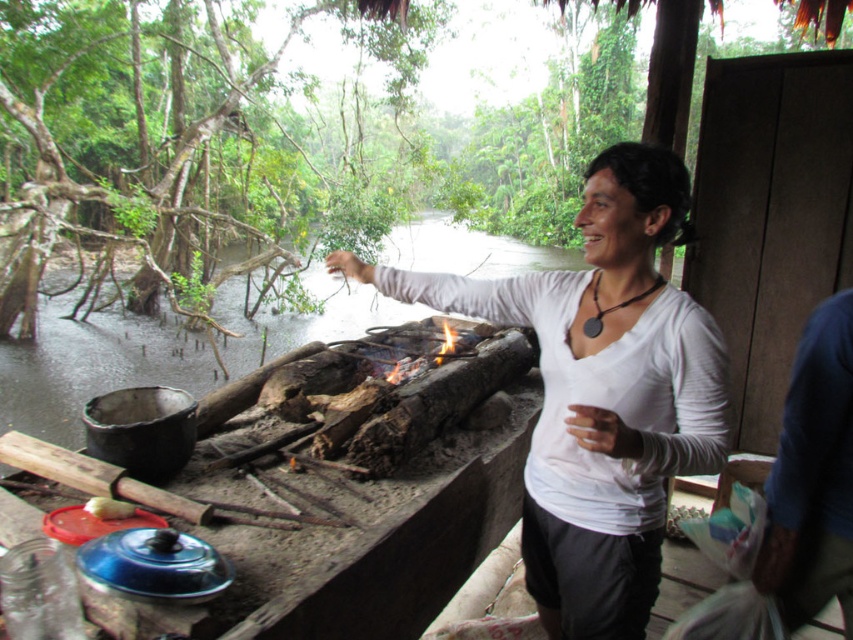
You are an observer standing in front of the cooking area. You notice two shirts hanging near the fire. The white matte shirt at center and the blue fabric shirt at right. Which shirt is positioned higher relative to the other?

The white matte shirt at center is positioned higher than the blue fabric shirt at right.

You are standing in the rustic outdoor cooking area near the river. You need to reach both the point at coordinates point (x=544, y=330) and the point at coordinates point (x=827, y=442). Which point will you reach first as you move forward?

You will reach the point at coordinates point (x=544, y=330) first because it is closer to you than the point at coordinates point (x=827, y=442), which is further away.